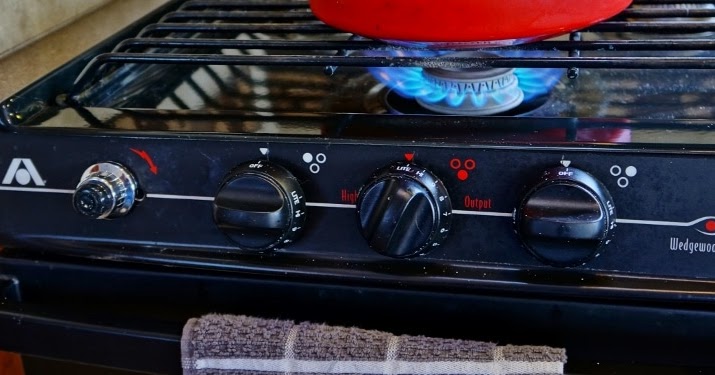
I want to click on stove brand wedgewood, so click(x=685, y=245).